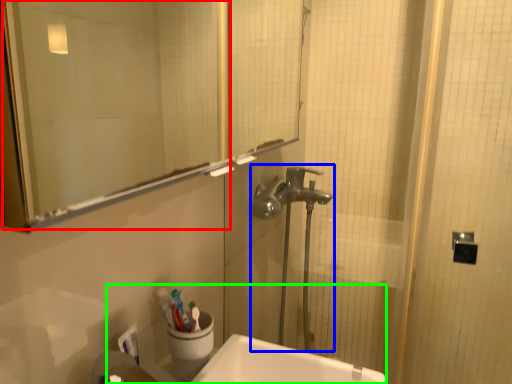
Question: Which object is the farthest from mirror (highlighted by a red box)? Choose among these: plumbing fixture (highlighted by a blue box) or sink (highlighted by a green box).

Choices:
 (A) plumbing fixture
 (B) sink

Answer: (B)